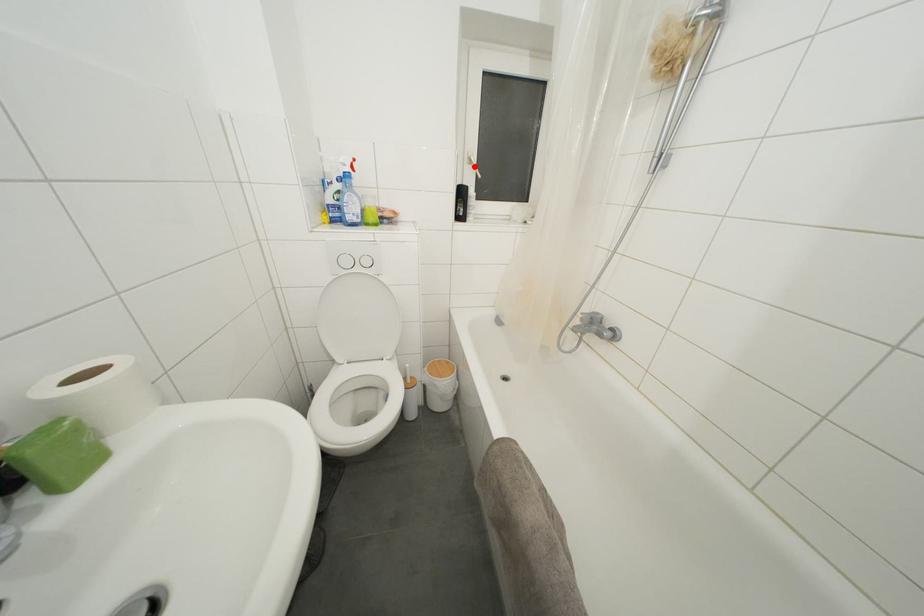
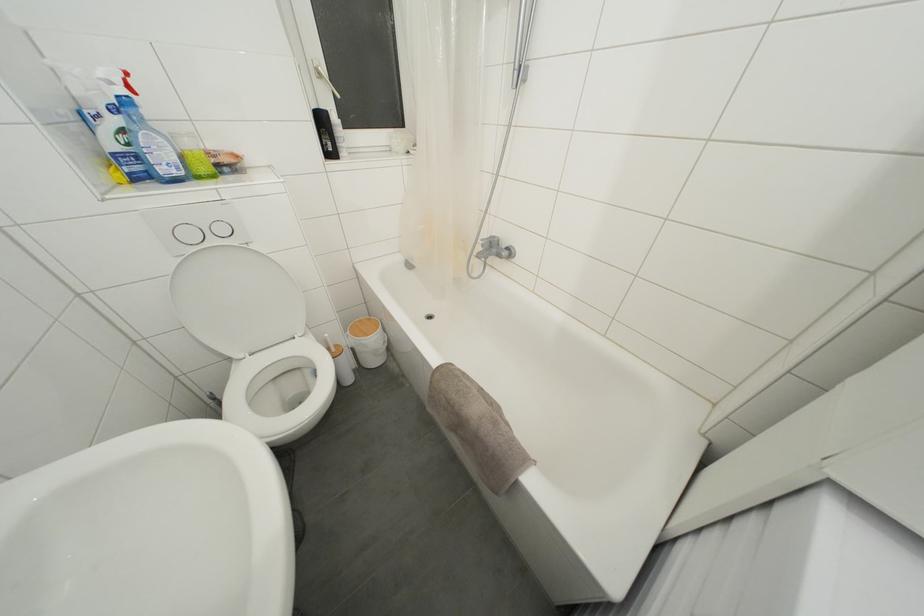
Question: I am providing you with two images of the same scene from different viewpoints. A red point is marked on the first image. At the location where the point appears in image 1, is it still visible in image 2?

Choices:
 (A) Yes
 (B) No

Answer: (A)